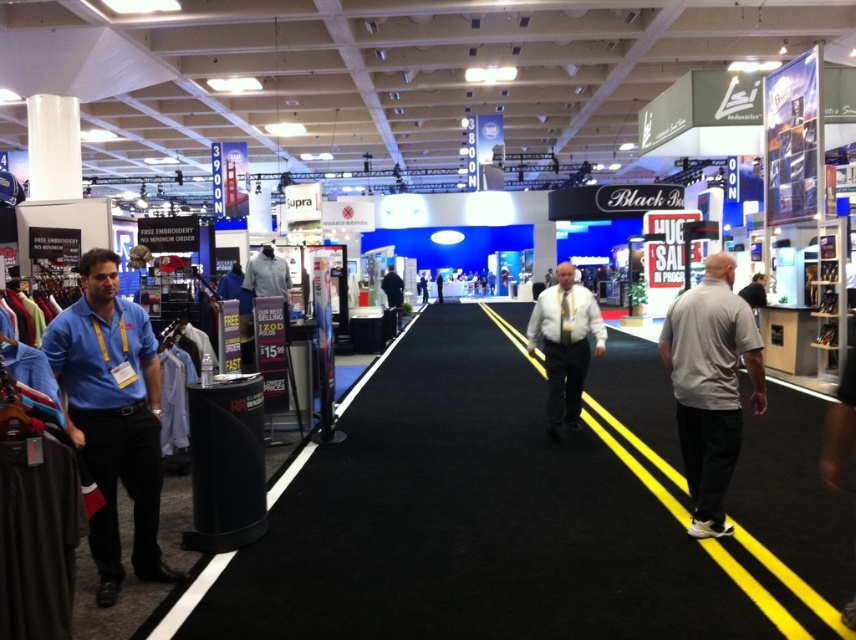
From the picture: You are an attendee at the exhibition and want to pick up a shirt. You see a blue cotton shirt at left and a white shirt at center. Which shirt is physically closer to you?

The blue cotton shirt at left is closer to the viewer than the white shirt at center, so the blue cotton shirt at left is physically closer to you.